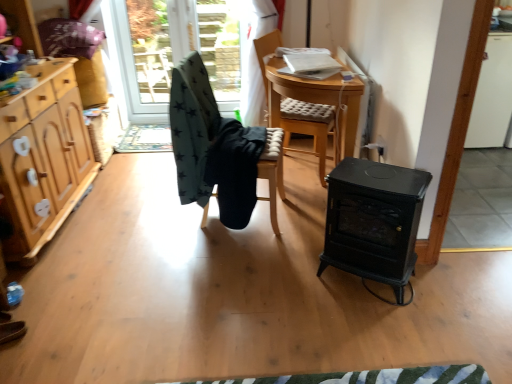
Question: From their relative heights in the image, would you say wooden cabinet at left is taller or shorter than transparent glass door at upper center, the 2th window screen in the right-to-left sequence?

Choices:
 (A) short
 (B) tall

Answer: (B)

Question: From a real-world perspective, is wooden cabinet at left physically located above or below transparent glass door at upper center, marked as the first window screen in a left-to-right arrangement?

Choices:
 (A) below
 (B) above

Answer: (B)

Question: Which of these objects is positioned farthest from the dark green fabric chair at center, which is the 1th chair from left to right?

Choices:
 (A) wooden chair with cushion at center, the 3th chair positioned from the left
 (B) black fabric chair at center, marked as the 2th chair in a right-to-left arrangement
 (C) wooden cabinet at left
 (D) transparent glass door at upper center, the 2th window screen in the right-to-left sequence
 (E) black cast iron stove at center

Answer: (D)

Question: Which of these objects is positioned closest to the green star-patterned fabric at upper left, which is the 2th window screen from left to right?

Choices:
 (A) dark green fabric chair at center, positioned as the third chair in right-to-left order
 (B) black cast iron stove at center
 (C) black fabric chair at center, the 2th chair positioned from the left
 (D) wooden chair with cushion at center, the 3th chair positioned from the left
 (E) wooden cabinet at left

Answer: (D)